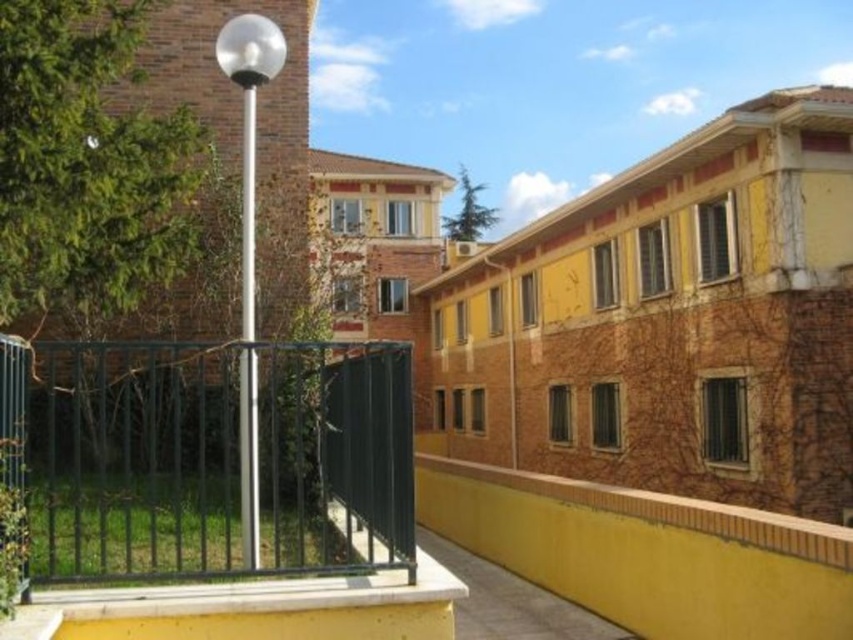
Question: Which object appears farthest from the camera in this image?

Choices:
 (A) polished metal pole at center
 (B) green metal fence at lower left
 (C) silver metallic pole at center

Answer: (B)

Question: Among these objects, which one is nearest to the camera?

Choices:
 (A) green metal fence at lower left
 (B) silver metallic pole at center
 (C) polished metal pole at center

Answer: (C)

Question: Is green metal fence at lower left bigger than silver metallic pole at center?

Choices:
 (A) yes
 (B) no

Answer: (B)

Question: Does silver metallic pole at center have a greater width compared to polished metal pole at center?

Choices:
 (A) no
 (B) yes

Answer: (A)

Question: Which of the following is the farthest from the observer?

Choices:
 (A) (248, 252)
 (B) (136, 481)
 (C) (241, 61)

Answer: (B)

Question: Is green metal fence at lower left above polished metal pole at center?

Choices:
 (A) yes
 (B) no

Answer: (B)